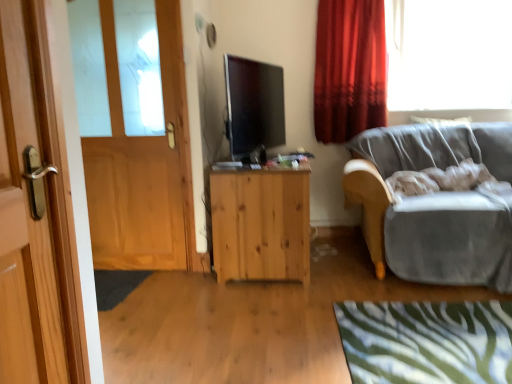
Question: Considering the positions of velvet gray couch at right and wooden door at left, placed as the second door when sorted from left to right, in the image, is velvet gray couch at right bigger or smaller than wooden door at left, placed as the second door when sorted from left to right,?

Choices:
 (A) big
 (B) small

Answer: (A)

Question: From the image's perspective, is velvet gray couch at right located above or below wooden door at left, placed as the second door when sorted from left to right?

Choices:
 (A) below
 (B) above

Answer: (B)

Question: Estimate the real-world distances between objects in this image. Which object is farther from the wooden door at left, arranged as the 1th door when viewed from the front?

Choices:
 (A) transparent glass window at upper right
 (B) velvet gray couch at right
 (C) red velvet curtain at upper right
 (D) wooden door at left, which is the 2th door from front to back
 (E) natural wood cabinet at center

Answer: (A)

Question: Which of these objects is positioned closest to the transparent glass window at upper right?

Choices:
 (A) wooden door at left, which is the first door from back to front
 (B) green zebra-patterned rug at lower right
 (C) natural wood cabinet at center
 (D) velvet gray couch at right
 (E) red velvet curtain at upper right

Answer: (E)